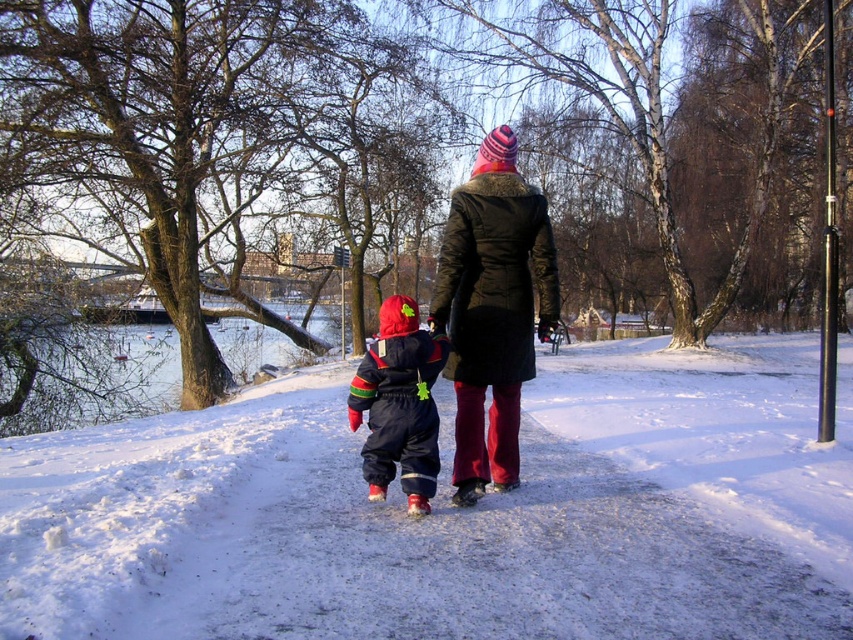
You are a photographer trying to capture the two people walking on the snow path. You want to ensure the white powdery snow at center and the velvet red snowsuit at center are both clearly visible in your photo. Based on their positions, which object should you focus on first to ensure both are in focus?

The white powdery snow at center is in front of the velvet red snowsuit at center. To ensure both are in focus, you should focus on the velvet red snowsuit at center first because it is closer to the camera, allowing the snow in front to also be within the depth of field.

Looking at this image, you are a photographer planning to take a photo of the scene. You want to ensure both the white powdery snow at center and the black wool coat at center are clearly visible. Given their sizes, which object might require more careful framing to avoid being overwhelmed by the other?

The black wool coat at center might require more careful framing because the white powdery snow at center is wider, so it could dominate the frame and make the coat appear smaller unless adjusted.